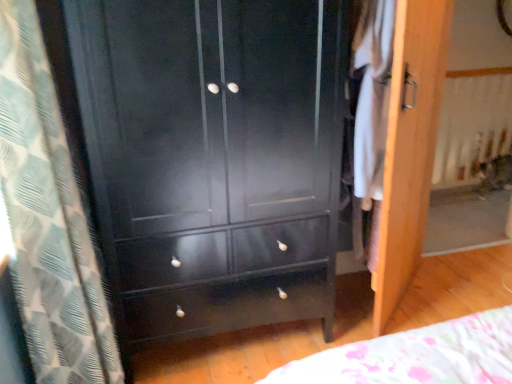
Question: Is matte black cabinet at center positioned with its back to white fabric at right?

Choices:
 (A) yes
 (B) no

Answer: (B)

Question: Is matte black cabinet at center to the left of white fabric at right from the viewer's perspective?

Choices:
 (A) yes
 (B) no

Answer: (A)

Question: Does matte black cabinet at center turn towards white fabric at right?

Choices:
 (A) yes
 (B) no

Answer: (B)

Question: From the image's perspective, is matte black cabinet at center beneath white fabric at right?

Choices:
 (A) no
 (B) yes

Answer: (B)

Question: Does matte black cabinet at center have a lesser width compared to white fabric at right?

Choices:
 (A) yes
 (B) no

Answer: (B)

Question: From a real-world perspective, is matte black cabinet at center located higher than white fabric at right?

Choices:
 (A) yes
 (B) no

Answer: (B)

Question: Is white fabric at right placed right next to wooden screen door at right?

Choices:
 (A) yes
 (B) no

Answer: (B)

Question: Is white fabric at right not near wooden screen door at right?

Choices:
 (A) no
 (B) yes

Answer: (A)

Question: Can you confirm if white fabric at right is smaller than wooden screen door at right?

Choices:
 (A) yes
 (B) no

Answer: (A)

Question: Considering the relative sizes of white fabric at right and wooden screen door at right in the image provided, is white fabric at right taller than wooden screen door at right?

Choices:
 (A) no
 (B) yes

Answer: (A)

Question: From a real-world perspective, is white fabric at right located higher than wooden screen door at right?

Choices:
 (A) yes
 (B) no

Answer: (A)

Question: From the image's perspective, would you say white fabric at right is shown under wooden screen door at right?

Choices:
 (A) no
 (B) yes

Answer: (A)

Question: Does white textured curtain at left have a larger size compared to wooden screen door at right?

Choices:
 (A) yes
 (B) no

Answer: (A)